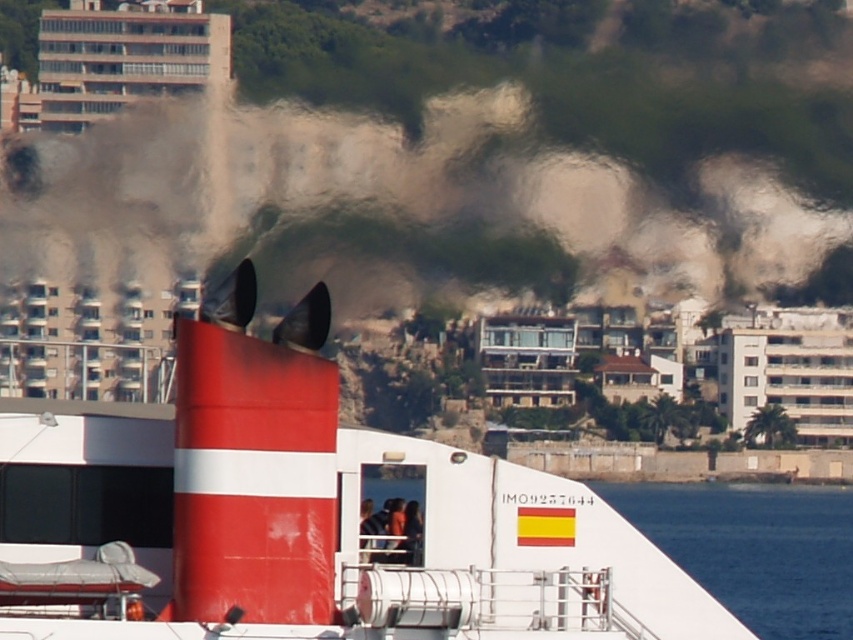
You are a drone operator tasked with capturing aerial footage of the smooth red and white boat at center and the black matte smoke at upper center. Your drone has a maximum operational range of 50 meters. Can your drone safely film both subjects without exceeding its range limit?

The distance between the smooth red and white boat at center and the black matte smoke at upper center is 51.65 meters, which exceeds the drone operator drone maximum operational range of 50 meters. Therefore, the drone cannot safely film both subjects without exceeding its range limit.

You are a drone operator trying to capture the ship and its smoke in a photo. The drone is currently at point 0.327, 0.477. Can you confirm if the drone is positioned directly above the black matte smoke at upper center?

Yes, the drone is positioned directly above the black matte smoke at upper center since the smoke is located at point (405, 209).